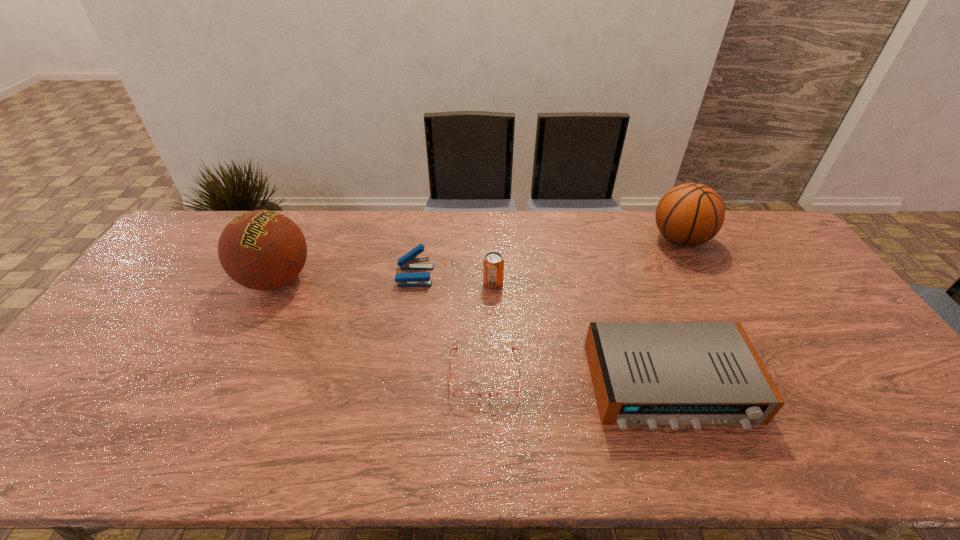
This screenshot has width=960, height=540. What are the coordinates of `empty space between the radio receiver and the stapler` in the screenshot? It's located at (542, 330).

In order to click on vacant point located between the shortest object and the left basketball in this screenshot , I will do `click(381, 327)`.

Locate an element on the screen. The height and width of the screenshot is (540, 960). empty space that is in between the radio receiver and the second object from left to right is located at coordinates (542, 330).

Locate an element on the screen. Image resolution: width=960 pixels, height=540 pixels. vacant area that lies between the radio receiver and the stapler is located at coordinates (542, 330).

The width and height of the screenshot is (960, 540). What are the coordinates of `unoccupied position between the spectacles and the soda can` in the screenshot? It's located at (489, 329).

Locate an element on the screen. Image resolution: width=960 pixels, height=540 pixels. vacant area between the spectacles and the radio receiver is located at coordinates (578, 380).

At what (x,y) coordinates should I click in order to perform the action: click on free area in between the shortest object and the radio receiver. Please return your answer as a coordinate pair (x, y). This screenshot has width=960, height=540. Looking at the image, I should click on (578, 380).

Locate an element on the screen. The height and width of the screenshot is (540, 960). unoccupied area between the soda can and the spectacles is located at coordinates (489, 329).

Find the location of `free space between the soda can and the left basketball`. free space between the soda can and the left basketball is located at coordinates (385, 281).

I want to click on vacant area that lies between the soda can and the shortest object, so (489, 329).